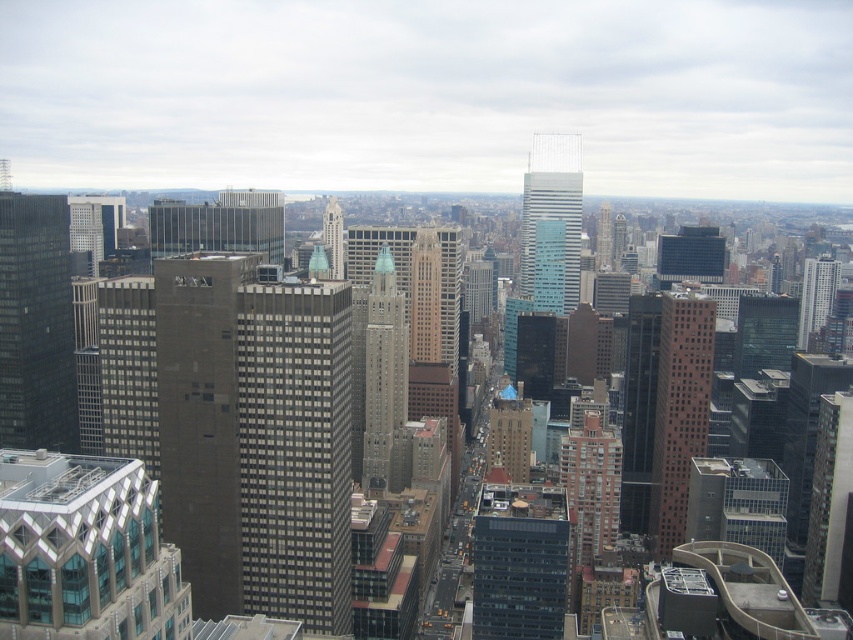
You are an urban planner assessing the city layout. You need to determine which of the two skyscrapers, the dark gray concrete skyscraper at center or the geometric glass skyscraper at lower left, has a larger footprint in terms of width. Based on the provided information, which one is wider?

The dark gray concrete skyscraper at center is wider than the geometric glass skyscraper at lower left according to the description.

You are a drone operator trying to navigate a delivery drone through the urban skyline. The drone must fly directly to the teal glass skyscraper at center. Given the coordinates provided, can you confirm the exact 2D location where the drone should aim?

The teal glass skyscraper at center is located at the 2D coordinates point (553,204), so the drone should aim for that exact point to reach its destination.

From the picture: You are an architect reviewing a cityscape. You notice the dark gray concrete skyscraper at center and the white glass building at upper right. Which building appears closer to you in the image?

The dark gray concrete skyscraper at center appears closer because it is positioned in front of the white glass building at upper right.